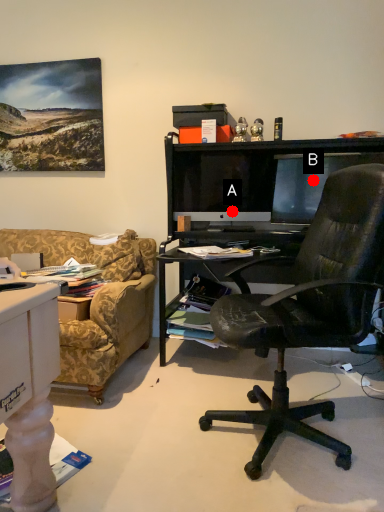
Question: Two points are circled on the image, labeled by A and B beside each circle. Among these points, which one is farthest from the camera?

Choices:
 (A) A is further
 (B) B is further

Answer: (A)